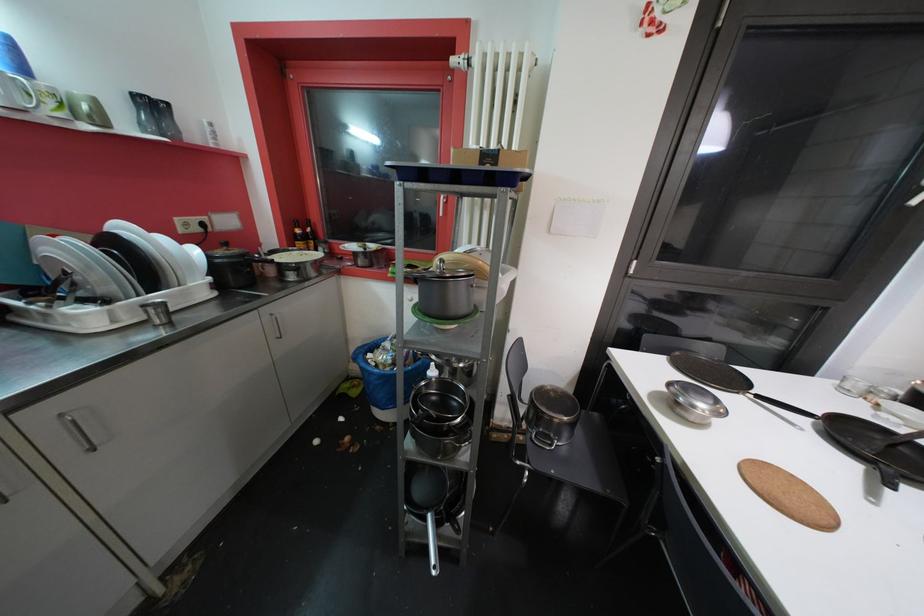
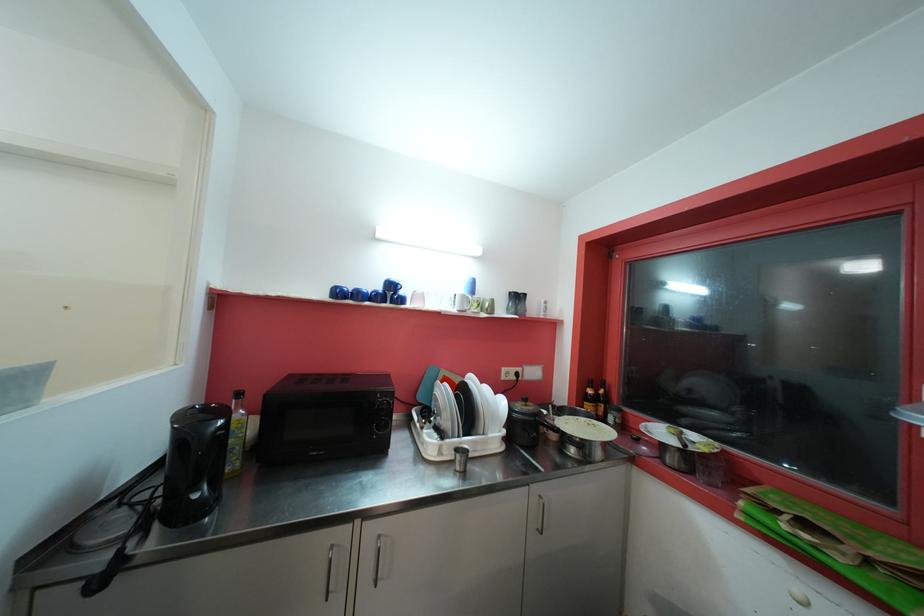
How did the camera likely rotate?

The camera's rotation is toward left-up.